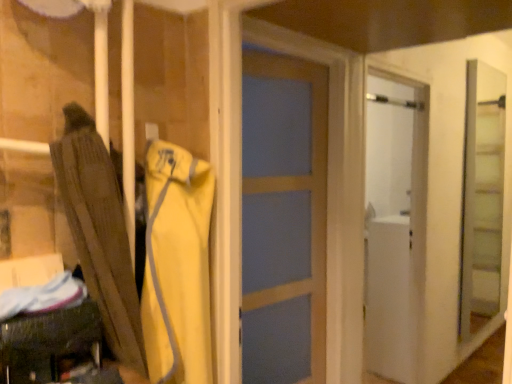
What is the approximate height of yellow fabric jacket at center?

The height of yellow fabric jacket at center is 75.43 centimeters.

Describe the element at coordinates (395, 226) in the screenshot. I see `white matte refrigerator at right` at that location.

Measure the distance between clear glass screen door at right and camera.

3.65 meters.

The width and height of the screenshot is (512, 384). What do you see at coordinates (482, 199) in the screenshot?
I see `clear glass screen door at right` at bounding box center [482, 199].

This screenshot has width=512, height=384. Find the location of `yellow fabric jacket at center`. yellow fabric jacket at center is located at coordinates (177, 266).

Based on their positions, is brown fabric umbrella at left located to the left or right of yellow fabric jacket at center?

brown fabric umbrella at left is to the left of yellow fabric jacket at center.

Does point (64, 158) come in front of point (205, 163)?

Yes.

Is brown fabric umbrella at left placed right next to yellow fabric jacket at center?

They are not placed beside each other.

Looking at their sizes, would you say brown fabric umbrella at left is wider or thinner than yellow fabric jacket at center?

In the image, brown fabric umbrella at left appears to be wider than yellow fabric jacket at center.

Measure the distance from white matte refrigerator at right to brown fabric umbrella at left.

The distance of white matte refrigerator at right from brown fabric umbrella at left is 1.70 meters.

Between white matte refrigerator at right and brown fabric umbrella at left, which one is positioned in front?

brown fabric umbrella at left is closer to the camera.

Does white matte refrigerator at right turn towards brown fabric umbrella at left?

No, white matte refrigerator at right is not oriented towards brown fabric umbrella at left.

Consider the image. Which object is positioned more to the left, white matte refrigerator at right or brown fabric umbrella at left?

Positioned to the left is brown fabric umbrella at left.

From a real-world perspective, is brown fabric umbrella at left above or below clear glass screen door at right?

From a real-world perspective, brown fabric umbrella at left is physically above clear glass screen door at right.

Which is further, (135, 304) or (499, 175)?

Positioned behind is point (499, 175).

Considering the relative sizes of brown fabric umbrella at left and clear glass screen door at right in the image provided, is brown fabric umbrella at left shorter than clear glass screen door at right?

Yes, brown fabric umbrella at left is shorter than clear glass screen door at right.

Is yellow fabric jacket at center at the right side of white matte refrigerator at right?

No.

Is yellow fabric jacket at center placed right next to white matte refrigerator at right?

yellow fabric jacket at center is not next to white matte refrigerator at right, and they're not touching.

Is yellow fabric jacket at center in front of or behind white matte refrigerator at right in the image?

yellow fabric jacket at center is positioned closer to the viewer than white matte refrigerator at right.

Considering the relative sizes of yellow fabric jacket at center and white matte refrigerator at right in the image provided, is yellow fabric jacket at center shorter than white matte refrigerator at right?

Yes.

Looking at this image, is brown fabric umbrella at left not within white matte refrigerator at right?

Yes.

Considering the relative positions of brown fabric umbrella at left and white matte refrigerator at right in the image provided, is brown fabric umbrella at left to the left or to the right of white matte refrigerator at right?

In the image, brown fabric umbrella at left appears on the left side of white matte refrigerator at right.

Which object is thinner, brown fabric umbrella at left or white matte refrigerator at right?

brown fabric umbrella at left is thinner.

Which of these two, brown fabric umbrella at left or white matte refrigerator at right, is bigger?

white matte refrigerator at right is bigger.

From the image's perspective, is clear glass screen door at right above yellow fabric jacket at center?

Yes, from the image's perspective, clear glass screen door at right is above yellow fabric jacket at center.

Is yellow fabric jacket at center at the back of clear glass screen door at right?

No, yellow fabric jacket at center is not at the back of clear glass screen door at right.

Is clear glass screen door at right positioned behind yellow fabric jacket at center?

Yes.

Considering the relative sizes of clear glass screen door at right and yellow fabric jacket at center in the image provided, is clear glass screen door at right wider than yellow fabric jacket at center?

No, clear glass screen door at right is not wider than yellow fabric jacket at center.

Is white matte refrigerator at right smaller than yellow fabric jacket at center?

No.

Is white matte refrigerator at right not close to yellow fabric jacket at center?

That's right, there is a large distance between white matte refrigerator at right and yellow fabric jacket at center.

From a real-world perspective, between white matte refrigerator at right and yellow fabric jacket at center, who is vertically lower?

white matte refrigerator at right, from a real-world perspective.

Is white matte refrigerator at right aimed at yellow fabric jacket at center?

No.

I want to click on umbrella in front of the yellow fabric jacket at center, so click(101, 231).

Find the location of a particular element. This screenshot has height=384, width=512. door directly beneath the brown fabric umbrella at left (from a real-world perspective) is located at coordinates (395, 226).

Which object lies nearer to the anchor point yellow fabric jacket at center, brown fabric umbrella at left or white matte refrigerator at right?

The object closer to yellow fabric jacket at center is brown fabric umbrella at left.

Considering their positions, is white matte refrigerator at right positioned further to yellow fabric jacket at center than brown fabric umbrella at left?

Based on the image, white matte refrigerator at right appears to be further to yellow fabric jacket at center.

Based on their spatial positions, is yellow fabric jacket at center or brown fabric umbrella at left closer to white matte refrigerator at right?

yellow fabric jacket at center.

Estimate the real-world distances between objects in this image. Which object is closer to clear glass screen door at right, white matte refrigerator at right or brown fabric umbrella at left?

The object closer to clear glass screen door at right is white matte refrigerator at right.

Which object lies further to the anchor point white matte refrigerator at right, clear glass screen door at right or yellow fabric jacket at center?

Based on the image, clear glass screen door at right appears to be further to white matte refrigerator at right.

When comparing their distances from white matte refrigerator at right, does brown fabric umbrella at left or clear glass screen door at right seem further?

brown fabric umbrella at left is positioned further to the anchor white matte refrigerator at right.

Estimate the real-world distances between objects in this image. Which object is closer to brown fabric umbrella at left, clear glass screen door at right or white matte refrigerator at right?

The object closer to brown fabric umbrella at left is white matte refrigerator at right.

From the image, which object appears to be nearer to clear glass screen door at right, brown fabric umbrella at left or white matte refrigerator at right?

The object closer to clear glass screen door at right is white matte refrigerator at right.

Find the location of a particular element. This screenshot has height=384, width=512. door between yellow fabric jacket at center and clear glass screen door at right from front to back is located at coordinates (395, 226).

You are a GUI agent. You are given a task and a screenshot of the screen. Output one action in this format:
    pyautogui.click(x=<x>, y=<y>)
    Task: Click on the clothing between brown fabric umbrella at left and clear glass screen door at right from left to right
    This screenshot has height=384, width=512.
    Given the screenshot: What is the action you would take?
    pyautogui.click(x=177, y=266)

Locate an element on the screen. clothing located between brown fabric umbrella at left and white matte refrigerator at right in the depth direction is located at coordinates (177, 266).

In order to click on door between brown fabric umbrella at left and clear glass screen door at right from front to back in this screenshot , I will do `click(395, 226)`.